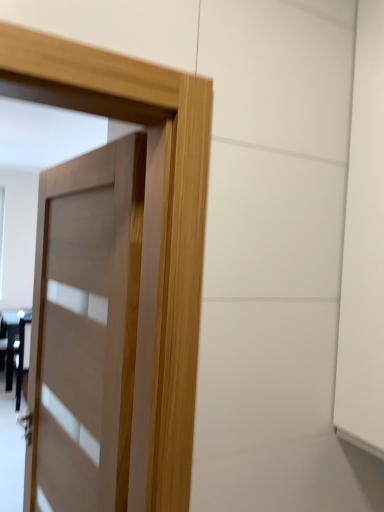
Question: From a real-world perspective, is matte black table at lower left on matte wood door at center?

Choices:
 (A) no
 (B) yes

Answer: (A)

Question: Could matte wood door at center be considered to be inside matte black table at lower left?

Choices:
 (A) yes
 (B) no

Answer: (B)

Question: Can you confirm if matte black table at lower left is thinner than matte wood door at center?

Choices:
 (A) yes
 (B) no

Answer: (B)

Question: Is matte black table at lower left positioned in front of matte wood door at center?

Choices:
 (A) yes
 (B) no

Answer: (B)

Question: From the image's perspective, would you say matte black table at lower left is shown under matte wood door at center?

Choices:
 (A) yes
 (B) no

Answer: (A)

Question: Is matte black table at lower left not inside matte wood door at center?

Choices:
 (A) no
 (B) yes

Answer: (B)

Question: Is matte wood door at center not close to matte black table at lower left?

Choices:
 (A) yes
 (B) no

Answer: (A)

Question: Is matte wood door at center to the left of matte black table at lower left from the viewer's perspective?

Choices:
 (A) no
 (B) yes

Answer: (A)

Question: Is matte wood door at center turned away from matte black table at lower left?

Choices:
 (A) yes
 (B) no

Answer: (B)

Question: Would you say matte wood door at center contains matte black table at lower left?

Choices:
 (A) yes
 (B) no

Answer: (B)

Question: Is matte wood door at center oriented towards matte black table at lower left?

Choices:
 (A) yes
 (B) no

Answer: (B)

Question: Considering the relative sizes of matte wood door at center and matte black table at lower left in the image provided, is matte wood door at center shorter than matte black table at lower left?

Choices:
 (A) yes
 (B) no

Answer: (B)

Question: Is matte wood door at center in front of or behind matte black table at lower left in the image?

Choices:
 (A) front
 (B) behind

Answer: (A)